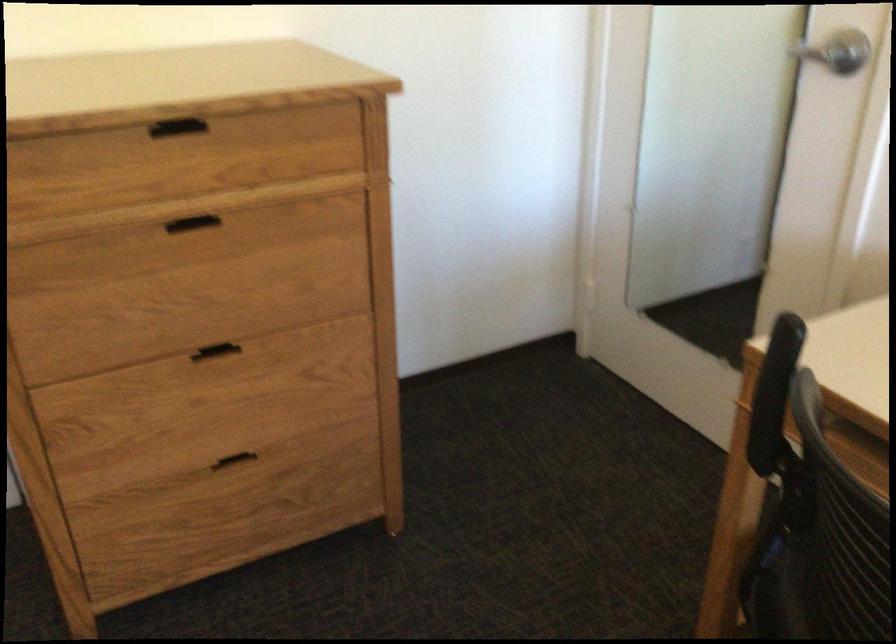
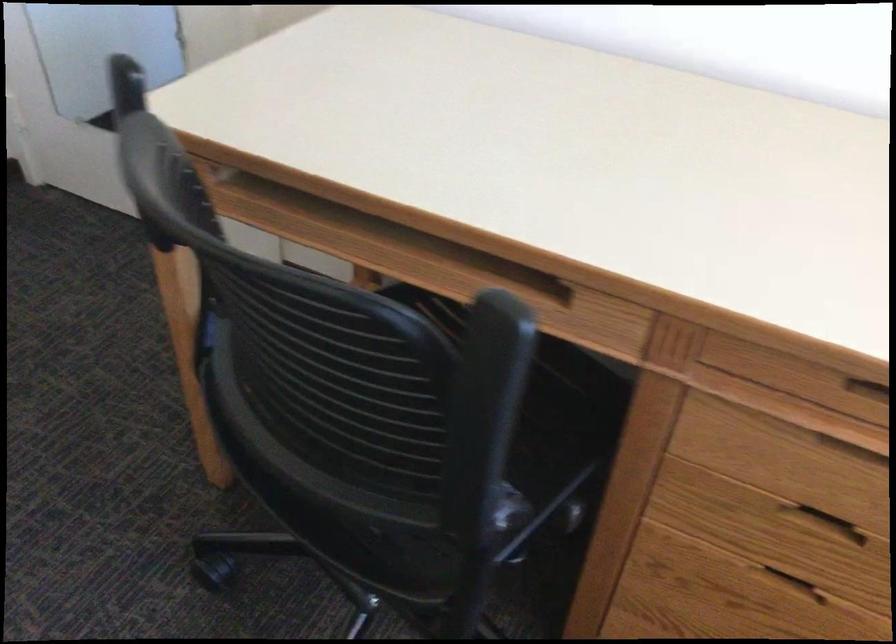
Question: The camera is either moving clockwise (left) or counter-clockwise (right) around the object. The first image is from the beginning of the video and the second image is from the end. Is the camera moving left or right when shooting the video?

Choices:
 (A) Left
 (B) Right

Answer: (A)